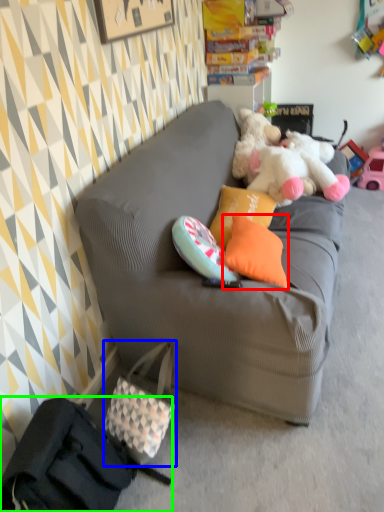
Question: Which object is positioned farthest from pillow (highlighted by a red box)? Select from handbag (highlighted by a blue box) and handbag (highlighted by a green box).

Choices:
 (A) handbag
 (B) handbag

Answer: (B)